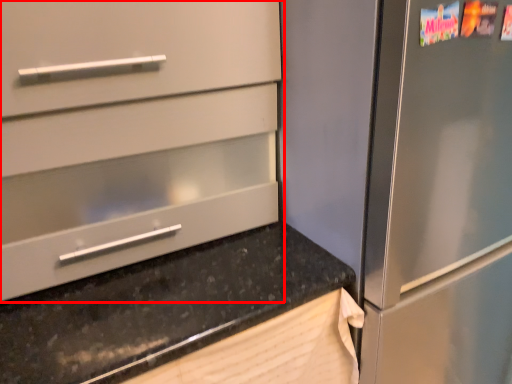
Question: Where is cabinetry (annotated by the red box) located in relation to countertop in the image?

Choices:
 (A) right
 (B) left

Answer: (B)